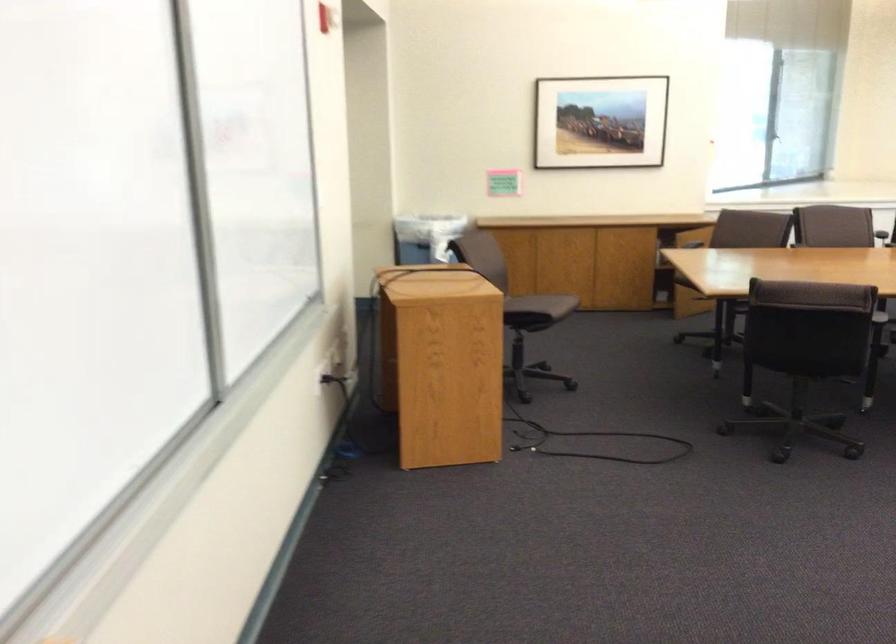
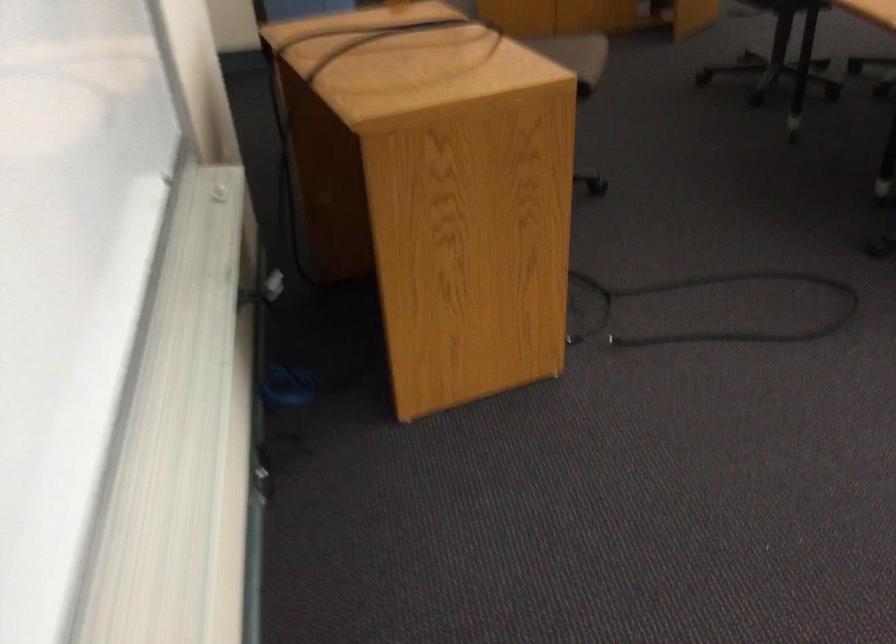
Question: In a continuous first-person perspective shot, in which direction is the camera moving?

Choices:
 (A) Left
 (B) Right
 (C) Forward
 (D) Backward

Answer: (C)